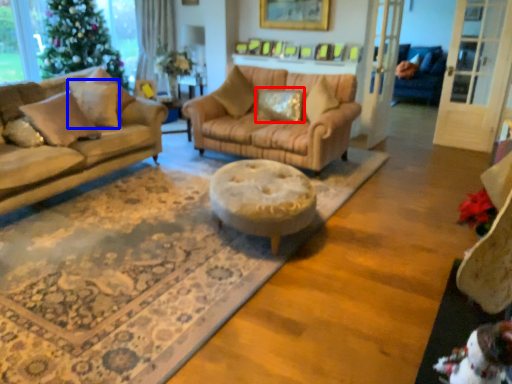
Question: Which object appears farthest to the camera in this image, pillow (highlighted by a red box) or pillow (highlighted by a blue box)?

Choices:
 (A) pillow
 (B) pillow

Answer: (A)